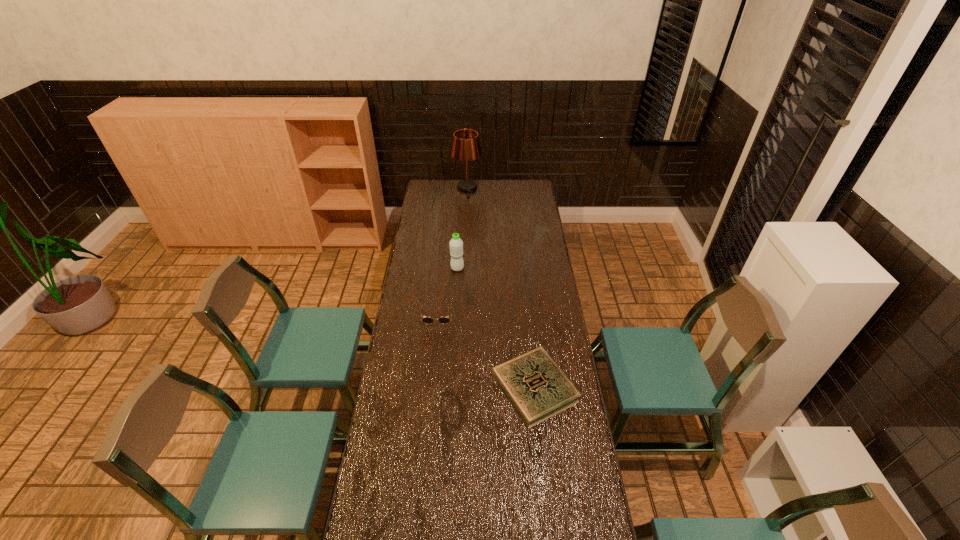
What are the coordinates of `vacant space located on the front lenses of the third tallest object` in the screenshot? It's located at (434, 355).

Find the location of `free location located 0.050m on the front of the hardback book`. free location located 0.050m on the front of the hardback book is located at coordinates (540, 441).

I want to click on object that is at the far edge, so click(x=466, y=146).

Identify the location of object that is at the left edge. The image size is (960, 540). (427, 320).

I want to click on object located at the right edge, so click(x=537, y=388).

Locate an element on the screen. free space at the left edge of the desktop is located at coordinates (443, 204).

Locate an element on the screen. free space at the right edge is located at coordinates [536, 309].

This screenshot has width=960, height=540. What are the coordinates of `vacant region at the far left corner of the desktop` in the screenshot? It's located at (444, 185).

Where is `free location at the far right corner`? The image size is (960, 540). free location at the far right corner is located at coordinates (533, 186).

At what (x,y) coordinates should I click in order to perform the action: click on unoccupied area between the water bottle and the sunglasses. Please return your answer as a coordinate pair (x, y). Looking at the image, I should click on (447, 293).